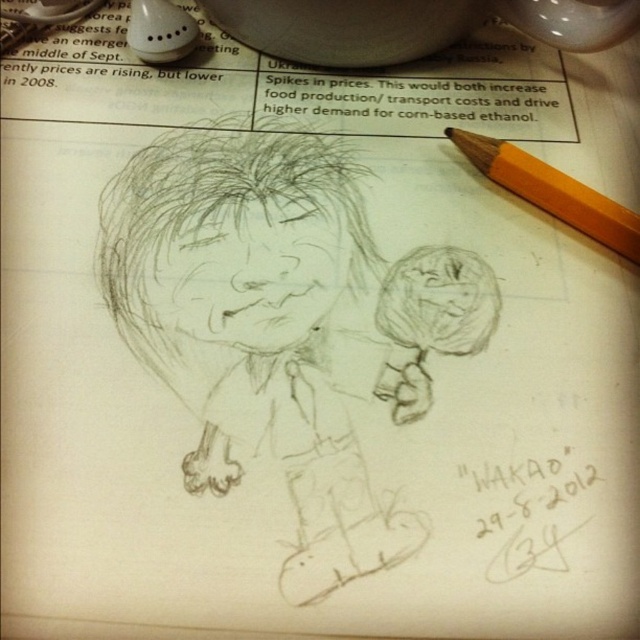
Question: Which point is closer to the camera taking this photo?

Choices:
 (A) (221, 140)
 (B) (561, 205)

Answer: (B)

Question: Can you confirm if graphite sketch at center is smaller than yellow wood pencil at upper right?

Choices:
 (A) no
 (B) yes

Answer: (A)

Question: Is graphite sketch at center below yellow wood pencil at upper right?

Choices:
 (A) yes
 (B) no

Answer: (A)

Question: Is graphite sketch at center to the left of yellow wood pencil at upper right from the viewer's perspective?

Choices:
 (A) no
 (B) yes

Answer: (B)

Question: Which point is closer to the camera taking this photo?

Choices:
 (A) (522, 186)
 (B) (416, 416)

Answer: (B)